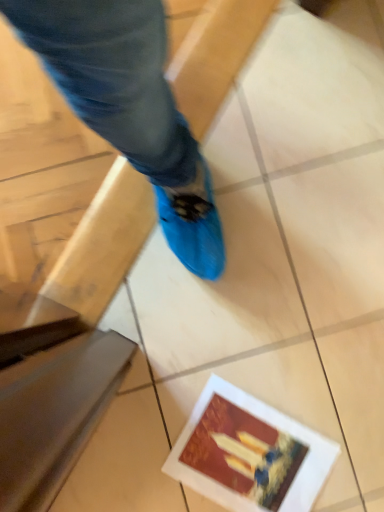
Question: Does matte paper postcard at lower right have a lesser width compared to smooth beige tile at lower left?

Choices:
 (A) yes
 (B) no

Answer: (B)

Question: Can you confirm if matte paper postcard at lower right is taller than smooth beige tile at lower left?

Choices:
 (A) yes
 (B) no

Answer: (B)

Question: Does matte paper postcard at lower right appear on the right side of smooth beige tile at lower left?

Choices:
 (A) no
 (B) yes

Answer: (B)

Question: From a real-world perspective, is matte paper postcard at lower right beneath smooth beige tile at lower left?

Choices:
 (A) no
 (B) yes

Answer: (B)

Question: Does matte paper postcard at lower right turn towards smooth beige tile at lower left?

Choices:
 (A) yes
 (B) no

Answer: (B)

Question: Is matte paper postcard at lower right further to the viewer compared to smooth beige tile at lower left?

Choices:
 (A) no
 (B) yes

Answer: (B)

Question: From the image's perspective, does smooth beige tile at lower left appear lower than matte paper postcard at lower right?

Choices:
 (A) no
 (B) yes

Answer: (A)

Question: Is smooth beige tile at lower left next to matte paper postcard at lower right and touching it?

Choices:
 (A) yes
 (B) no

Answer: (B)

Question: Could matte paper postcard at lower right be considered to be inside smooth beige tile at lower left?

Choices:
 (A) no
 (B) yes

Answer: (A)

Question: Is smooth beige tile at lower left to the left of matte paper postcard at lower right from the viewer's perspective?

Choices:
 (A) no
 (B) yes

Answer: (B)

Question: Considering the relative sizes of smooth beige tile at lower left and matte paper postcard at lower right in the image provided, is smooth beige tile at lower left wider than matte paper postcard at lower right?

Choices:
 (A) yes
 (B) no

Answer: (B)

Question: From a real-world perspective, is smooth beige tile at lower left physically below matte paper postcard at lower right?

Choices:
 (A) yes
 (B) no

Answer: (B)

Question: Is smooth beige tile at lower left inside the boundaries of matte paper postcard at lower right, or outside?

Choices:
 (A) outside
 (B) inside

Answer: (A)